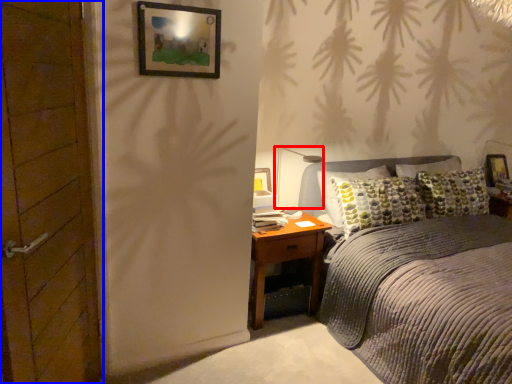
Question: Among these objects, which one is farthest to the camera, light fixture (highlighted by a red box) or door (highlighted by a blue box)?

Choices:
 (A) light fixture
 (B) door

Answer: (A)